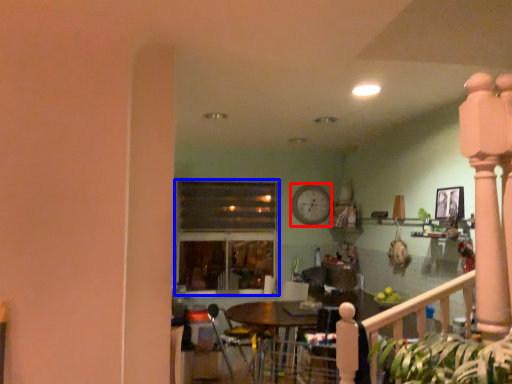
Question: Which object is further to the camera taking this photo, clock (highlighted by a red box) or window (highlighted by a blue box)?

Choices:
 (A) clock
 (B) window

Answer: (A)